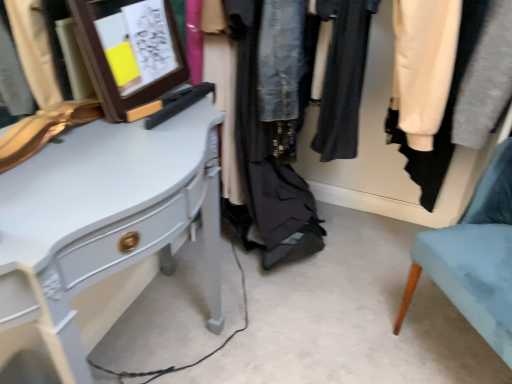
What is the approximate height of denim jacket at center?

denim jacket at center is 22.85 inches in height.

Identify the location of denim jacket at center. The image size is (512, 384). (396, 148).

What do you see at coordinates (129, 51) in the screenshot? The image size is (512, 384). I see `wooden frame at upper left` at bounding box center [129, 51].

The image size is (512, 384). Find the location of `denim jacket at center`. denim jacket at center is located at coordinates (396, 148).

Considering the positions of objects white glossy desk at left and denim jacket at center in the image provided, who is more to the right, white glossy desk at left or denim jacket at center?

From the viewer's perspective, denim jacket at center appears more on the right side.

The height and width of the screenshot is (384, 512). Find the location of `desk in front of the denim jacket at center`. desk in front of the denim jacket at center is located at coordinates (104, 218).

Is white glossy desk at left inside or outside of denim jacket at center?

white glossy desk at left is outside denim jacket at center.

From a real-world perspective, is white glossy desk at left physically located above or below denim jacket at center?

In terms of real-world spatial position, white glossy desk at left is below denim jacket at center.

Does point (463, 240) come farther from viewer compared to point (169, 71)?

Yes, it is.

From a real-world perspective, is light blue fabric chair at lower right on wooden frame at upper left?

Actually, light blue fabric chair at lower right is physically below wooden frame at upper left in the real world.

Could you tell me if light blue fabric chair at lower right is turned towards wooden frame at upper left?

No, light blue fabric chair at lower right is not aimed at wooden frame at upper left.

Does wooden frame at upper left contain light blue fabric chair at lower right?

No, light blue fabric chair at lower right is located outside of wooden frame at upper left.

Is light blue fabric chair at lower right at the back of wooden frame at upper left?

No, wooden frame at upper left is not facing away from light blue fabric chair at lower right.

Can you confirm if wooden frame at upper left is bigger than light blue fabric chair at lower right?

No.

In terms of size, does wooden frame at upper left appear bigger or smaller than denim jacket at center?

Clearly, wooden frame at upper left is smaller in size than denim jacket at center.

Find the location of a particular element. The image size is (512, 384). closet below the wooden frame at upper left (from a real-world perspective) is located at coordinates tap(396, 148).

Is wooden frame at upper left positioned before denim jacket at center?

Yes, it is in front of denim jacket at center.

Is wooden frame at upper left next to denim jacket at center?

They are not placed beside each other.

The width and height of the screenshot is (512, 384). What are the coordinates of `desk on the left of wooden frame at upper left` in the screenshot? It's located at (104, 218).

How distant is wooden frame at upper left from white glossy desk at left?

wooden frame at upper left is 9.41 inches away from white glossy desk at left.

From a real-world perspective, which object stands above the other?

wooden frame at upper left, from a real-world perspective.

Could you tell me if wooden frame at upper left is facing white glossy desk at left?

No.

I want to click on closet above the white glossy desk at left (from a real-world perspective), so click(396, 148).

Considering the positions of point (393, 201) and point (139, 158), is point (393, 201) closer or farther from the camera than point (139, 158)?

Point (393, 201) appears to be farther away from the viewer than point (139, 158).

From the image's perspective, who appears lower, denim jacket at center or white glossy desk at left?

white glossy desk at left, from the image's perspective.

Can white glossy desk at left be found inside denim jacket at center?

That's incorrect, white glossy desk at left is not inside denim jacket at center.

Is light blue fabric chair at lower right positioned with its back to denim jacket at center?

No, light blue fabric chair at lower right's orientation is not away from denim jacket at center.

Is point (454, 291) less distant than point (256, 139)?

Yes, it is in front of point (256, 139).

In terms of height, does light blue fabric chair at lower right look taller or shorter compared to denim jacket at center?

light blue fabric chair at lower right is taller than denim jacket at center.

Identify the location of desk that appears below the denim jacket at center (from the image's perspective). (104, 218).

At what (x,y) coordinates should I click in order to perform the action: click on chair that appears below the wooden frame at upper left (from a real-world perspective). Please return your answer as a coordinate pair (x, y). Looking at the image, I should click on (475, 257).

From the image, which object appears to be nearer to light blue fabric chair at lower right, wooden frame at upper left or white glossy desk at left?

Among the two, white glossy desk at left is located nearer to light blue fabric chair at lower right.

Looking at this image, looking at the image, which one is located further to light blue fabric chair at lower right, white glossy desk at left or wooden frame at upper left?

Among the two, wooden frame at upper left is located further to light blue fabric chair at lower right.

When comparing their distances from wooden frame at upper left, does white glossy desk at left or denim jacket at center seem closer?

white glossy desk at left.

Based on their spatial positions, is denim jacket at center or white glossy desk at left further from light blue fabric chair at lower right?

Based on the image, white glossy desk at left appears to be further to light blue fabric chair at lower right.

Which object lies nearer to the anchor point denim jacket at center, white glossy desk at left or light blue fabric chair at lower right?

Based on the image, light blue fabric chair at lower right appears to be nearer to denim jacket at center.

Based on their spatial positions, is light blue fabric chair at lower right or denim jacket at center further from white glossy desk at left?

denim jacket at center lies further to white glossy desk at left than the other object.

Estimate the real-world distances between objects in this image. Which object is closer to light blue fabric chair at lower right, wooden frame at upper left or denim jacket at center?

Among the two, denim jacket at center is located nearer to light blue fabric chair at lower right.

When comparing their distances from wooden frame at upper left, does denim jacket at center or white glossy desk at left seem closer?

The object closer to wooden frame at upper left is white glossy desk at left.

You are a GUI agent. You are given a task and a screenshot of the screen. Output one action in this format:
    pyautogui.click(x=<x>, y=<y>)
    Task: Click on the picture frame situated between white glossy desk at left and denim jacket at center from left to right
    
    Given the screenshot: What is the action you would take?
    pyautogui.click(x=129, y=51)

This screenshot has height=384, width=512. I want to click on picture frame between white glossy desk at left and light blue fabric chair at lower right from left to right, so click(129, 51).

Identify the location of closet between wooden frame at upper left and light blue fabric chair at lower right in the horizontal direction. This screenshot has height=384, width=512. (396, 148).

At what (x,y) coordinates should I click in order to perform the action: click on closet between white glossy desk at left and light blue fabric chair at lower right in the horizontal direction. Please return your answer as a coordinate pair (x, y). This screenshot has height=384, width=512. Looking at the image, I should click on (396, 148).